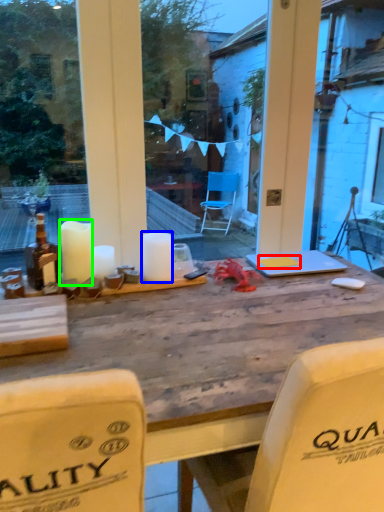
Question: Considering the real-world distances, which object is closest to notepad (highlighted by a red box)? candle (highlighted by a blue box) or candle (highlighted by a green box).

Choices:
 (A) candle
 (B) candle

Answer: (A)